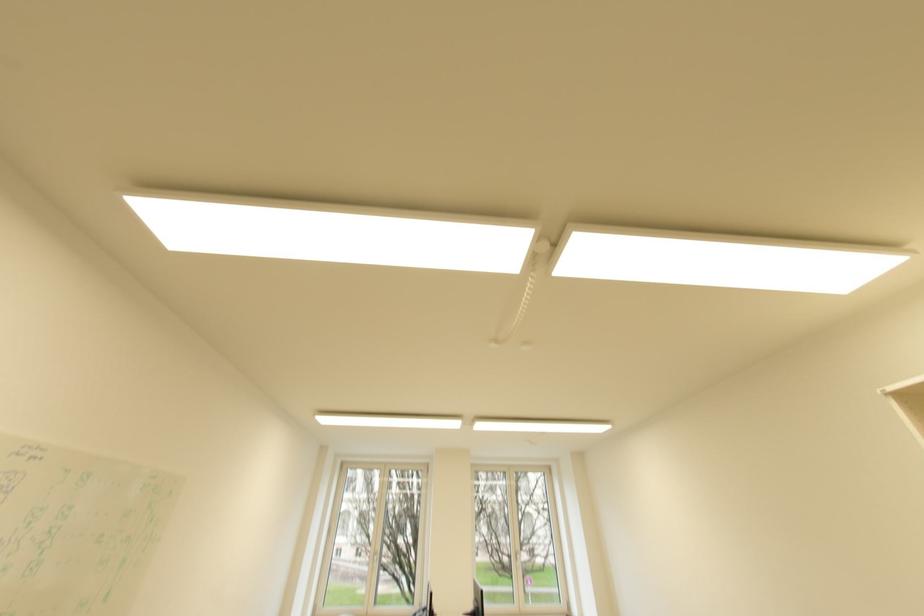
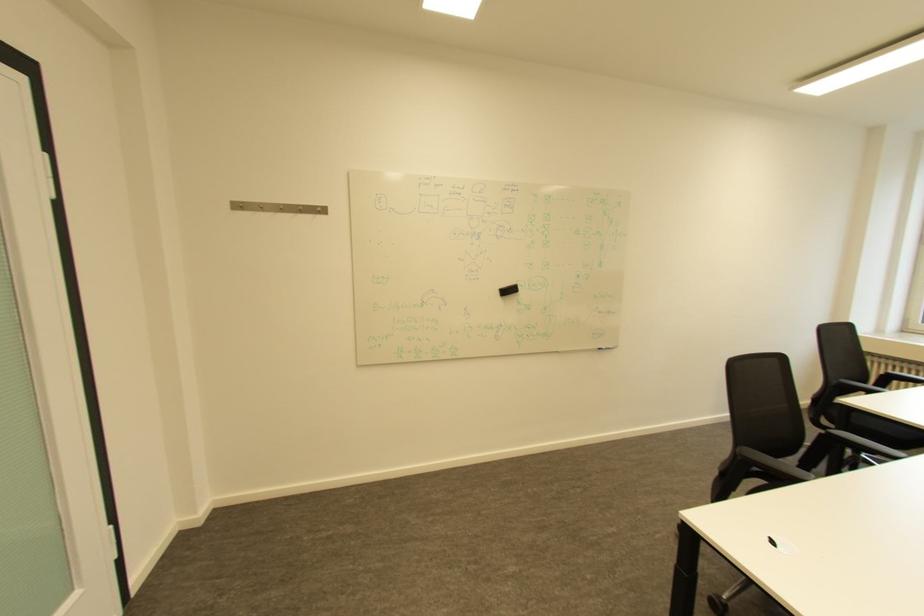
Question: Based on the continuous images, in which direction is the camera rotating? Reply with the corresponding letter.

Choices:
 (A) Left
 (B) Right
 (C) Up
 (D) Down

Answer: (A)